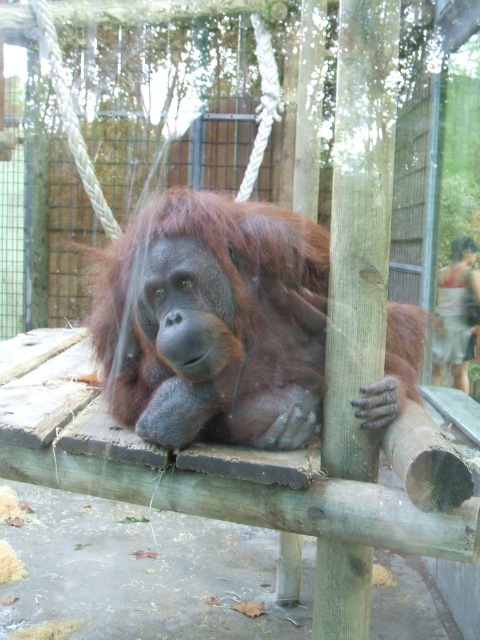
You are a zookeeper who needs to ensure the brown furry orangutan at center and the light brown fabric shorts at lower right are visible to visitors. Since the enclosure has limited space, which object should be moved closer to the viewing area to ensure both are visible without overlapping?

The light brown fabric shorts at lower right should be moved closer to the viewing area because the brown furry orangutan at center is wider than the light brown fabric shorts at lower right, so moving the narrower object closer would help prevent overlap while keeping both visible.